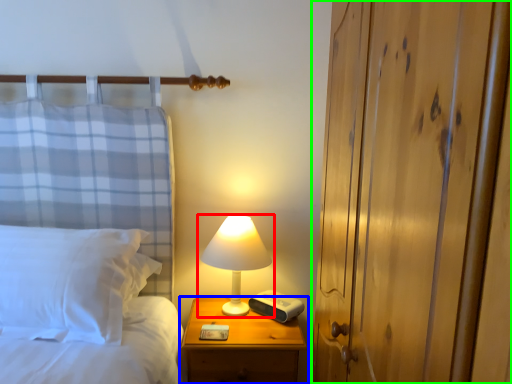
Question: Which object is positioned closest to lamp (highlighted by a red box)? Select from nightstand (highlighted by a blue box) and dresser (highlighted by a green box).

Choices:
 (A) nightstand
 (B) dresser

Answer: (A)